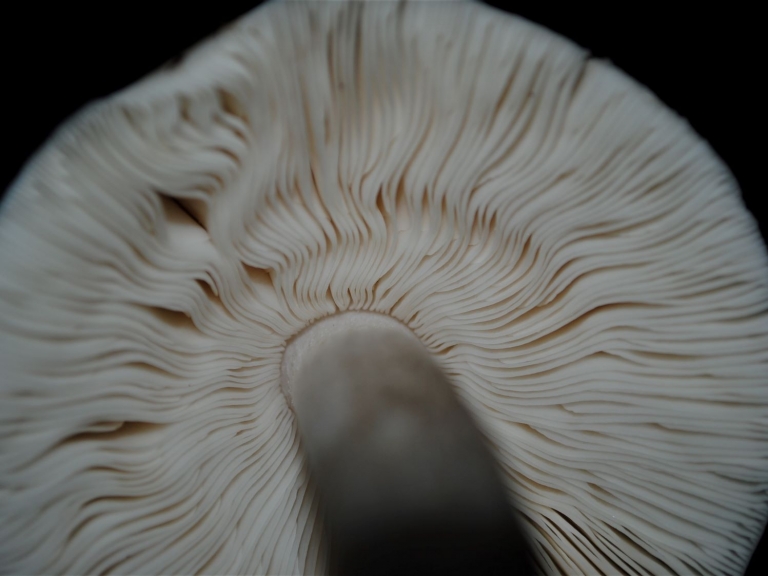
Where is `potential toilet paper roll`? The height and width of the screenshot is (576, 768). potential toilet paper roll is located at coordinates (480, 85).